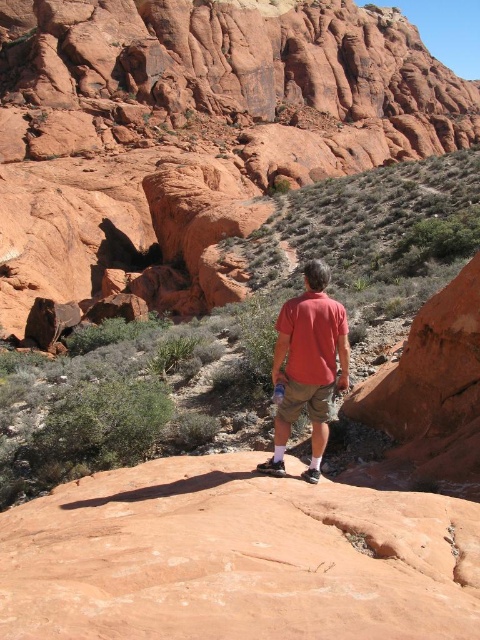
Question: Which object appears farthest from the camera in this image?

Choices:
 (A) khaki cotton shorts at center
 (B) matte red shirt at center

Answer: (A)

Question: Can you confirm if matte red shirt at center is positioned to the left of khaki cotton shorts at center?

Choices:
 (A) yes
 (B) no

Answer: (B)

Question: Which point appears closest to the camera in this image?

Choices:
 (A) (275, 372)
 (B) (288, 406)

Answer: (B)

Question: Is matte red shirt at center above khaki cotton shorts at center?

Choices:
 (A) yes
 (B) no

Answer: (A)

Question: Which object appears farthest from the camera in this image?

Choices:
 (A) matte red shirt at center
 (B) khaki cotton shorts at center

Answer: (B)

Question: Can you confirm if matte red shirt at center is bigger than khaki cotton shorts at center?

Choices:
 (A) yes
 (B) no

Answer: (A)